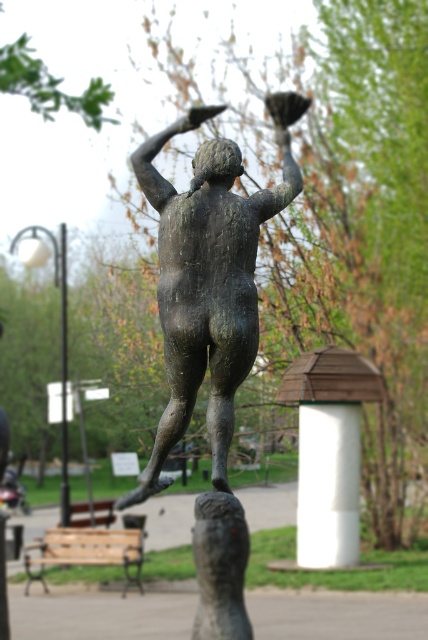
Is point (225, 160) in front of point (303, 438)?

Yes, point (225, 160) is in front of point (303, 438).

Does bronze statue at center have a smaller size compared to white painted wood at center?

Yes, bronze statue at center is smaller than white painted wood at center.

Does point (278, 124) lie in front of point (350, 353)?

Yes, it is.

This screenshot has width=428, height=640. I want to click on bronze statue at center, so click(208, 280).

Describe the element at coordinates (329, 451) in the screenshot. I see `white painted wood at center` at that location.

What do you see at coordinates (329, 451) in the screenshot? I see `white painted wood at center` at bounding box center [329, 451].

The image size is (428, 640). I want to click on white painted wood at center, so click(329, 451).

Does white smooth pillar at center come in front of bronze pole at center?

Yes.

Does white smooth pillar at center appear on the left side of bronze pole at center?

No, white smooth pillar at center is not to the left of bronze pole at center.

The width and height of the screenshot is (428, 640). Identify the location of white smooth pillar at center. (327, 484).